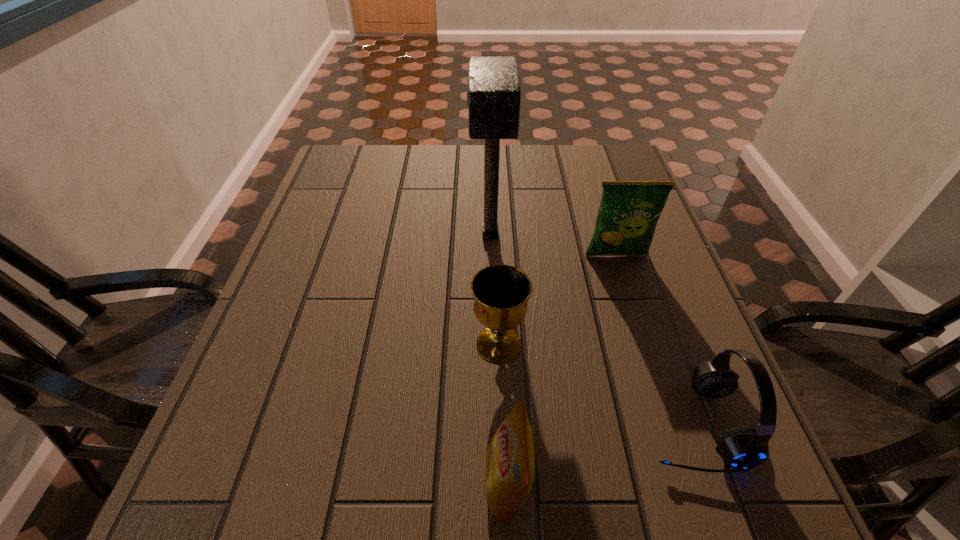
Locate an element on the screen. The image size is (960, 540). vacant region between the shorter crisp (potato chip) and the fourth shortest object is located at coordinates (562, 369).

Where is `vacant space that's between the tallest object and the headset`? This screenshot has width=960, height=540. vacant space that's between the tallest object and the headset is located at coordinates (591, 329).

Where is `vacant region between the fourth shortest object and the headset`? The image size is (960, 540). vacant region between the fourth shortest object and the headset is located at coordinates (654, 340).

Locate an element on the screen. vacant space that's between the farther crisp (potato chip) and the tallest object is located at coordinates (553, 245).

In order to click on vacant point located between the tallest object and the right crisp (potato chip) in this screenshot , I will do `click(553, 245)`.

Identify the location of free spot between the chalice and the right crisp (potato chip). (558, 300).

Identify the location of free area in between the left crisp (potato chip) and the chalice. The image size is (960, 540). (503, 414).

Identify which object is the third nearest to the third farthest object. Please provide its 2D coordinates. Your answer should be formatted as a tuple, i.e. [(x, y)], where the tuple contains the x and y coordinates of a point satisfying the conditions above.

[(494, 85)]

Locate an element on the screen. This screenshot has width=960, height=540. object that ranks as the fourth closest to the right crisp (potato chip) is located at coordinates (509, 459).

Find the location of a particular element. vacant position in the image that satisfies the following two spatial constraints: 1. on the front side of the tallest object; 2. on the left side of the chalice is located at coordinates click(493, 344).